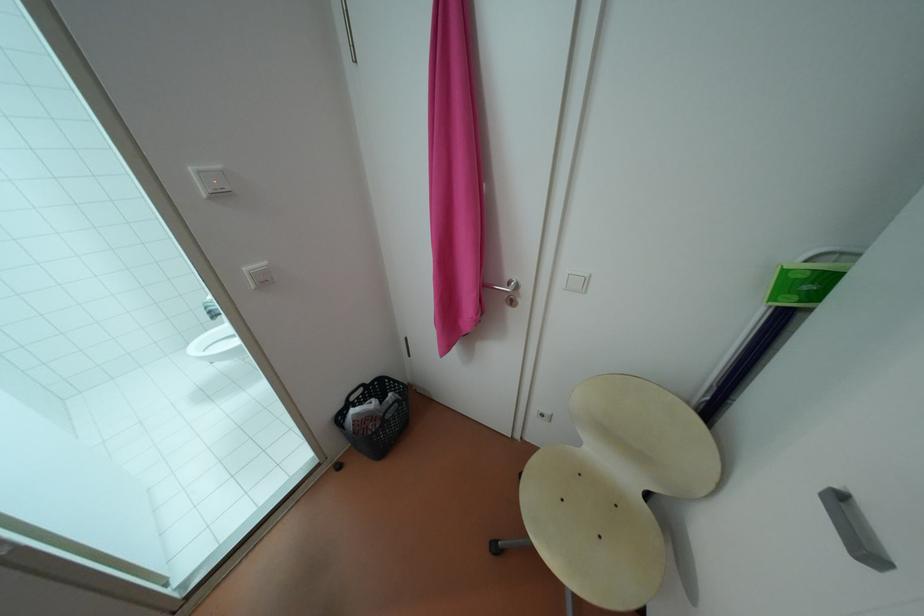
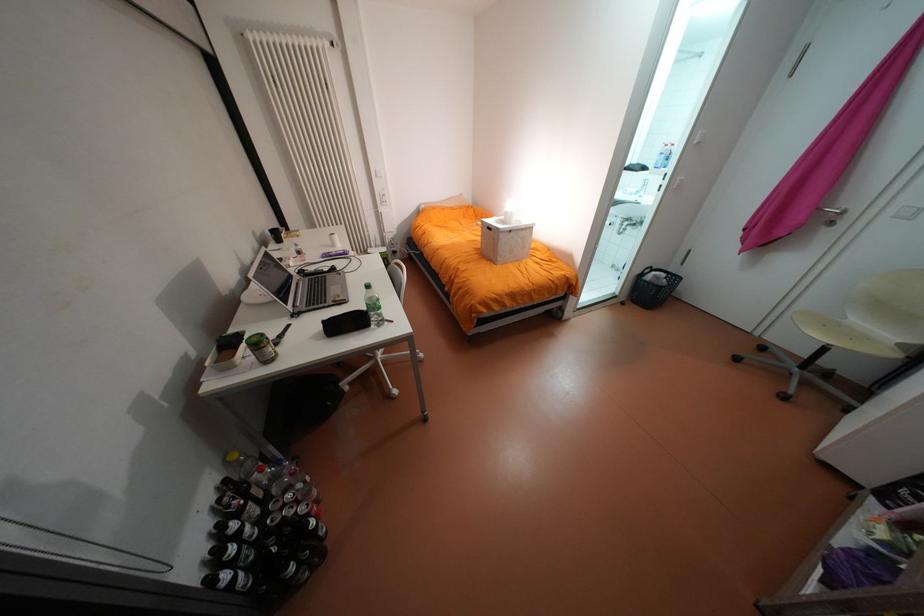
In the second image, find the point that corresponds to (360,410) in the first image.

(663, 273)